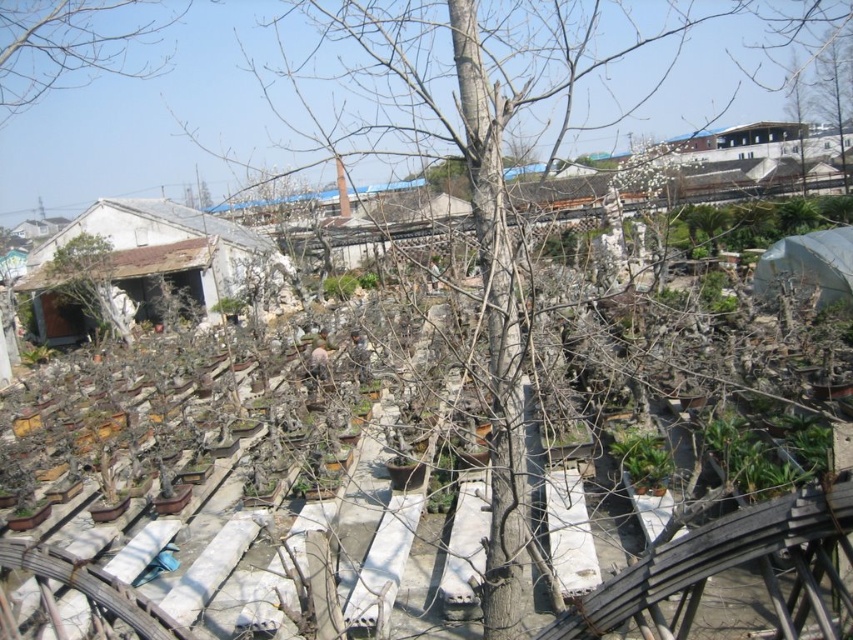
You are standing in the garden scene and want to locate the point marked at coordinates (74,44). According to the image, where exactly is this point located?

The point marked at coordinates (74,44) is located on the bare branches at the upper left of the image.

You are standing in the garden and want to take a photo of the point at coordinates point (51, 58) and point (102, 241). Which point should you focus on first to ensure both are in focus?

Point (51, 58) is closer to the camera than point (102, 241). To ensure both are in focus, focus on the closer point first, which is point (51, 58).

You are standing in the garden and want to know which object is taller between the bare branches at upper left and the brown wooden tree at center. Can you determine this based on their positions?

The bare branches at upper left has a greater height compared to the brown wooden tree at center, so the bare branches at upper left is taller.